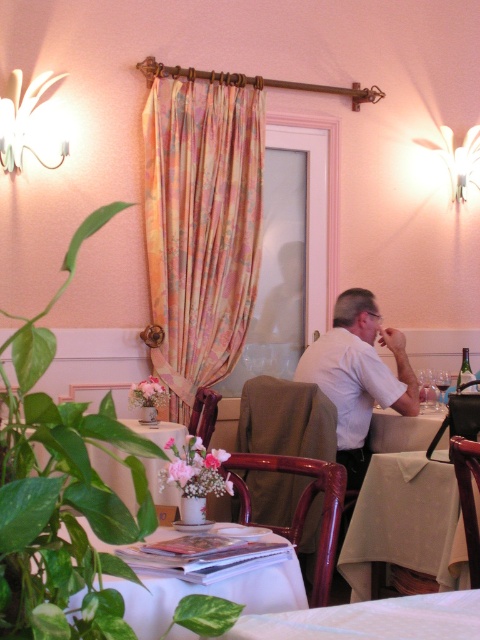
Question: Is floral silk curtain at upper left smaller than brown leather chair at center?

Choices:
 (A) yes
 (B) no

Answer: (B)

Question: Can you confirm if white paper at lower left is positioned below brown wood chair at center?

Choices:
 (A) yes
 (B) no

Answer: (B)

Question: Which object is the farthest from the white paper at lower left?

Choices:
 (A) brown leather chair at center
 (B) white glossy table at lower center

Answer: (A)

Question: Estimate the real-world distances between objects in this image. Which object is closer to the white glossy table at lower center?

Choices:
 (A) white paper at lower left
 (B) floral silk curtain at upper left
 (C) mahogany wood chair at center
 (D) white fabric tablecloth at lower center

Answer: (C)

Question: Among these objects, which one is nearest to the camera?

Choices:
 (A) white paper at lower left
 (B) smooth beige table at center
 (C) brown wood chair at center

Answer: (A)

Question: Is white fabric tablecloth at lower center positioned before brown leather chair at center?

Choices:
 (A) yes
 (B) no

Answer: (A)